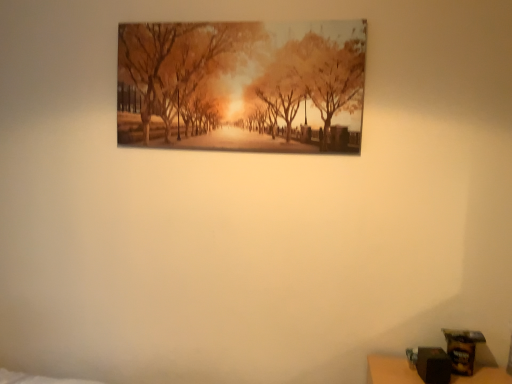
This screenshot has height=384, width=512. Describe the element at coordinates (242, 86) in the screenshot. I see `matte orange trees at center` at that location.

The image size is (512, 384). What are the coordinates of `matte orange trees at center` in the screenshot? It's located at (242, 86).

What are the coordinates of `matte orange trees at center` in the screenshot? It's located at (242, 86).